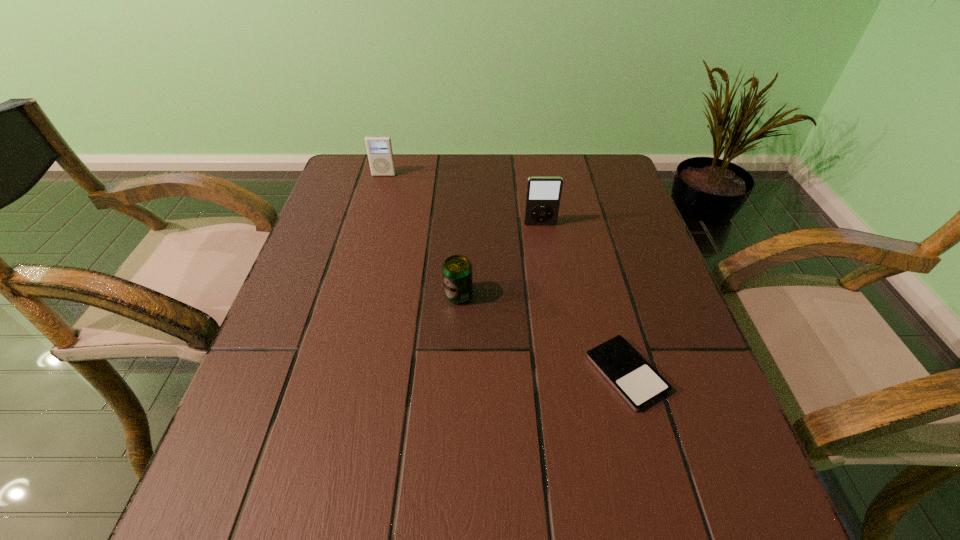
Locate an element on the screen. This screenshot has width=960, height=540. vacant region between the third object from left to right and the shortest object is located at coordinates (584, 299).

The width and height of the screenshot is (960, 540). Find the location of `unoccupied area between the third farthest object and the second farthest object`. unoccupied area between the third farthest object and the second farthest object is located at coordinates point(499,260).

Point out which object is positioned as the second nearest to the second iPod from left to right. Please provide its 2D coordinates. Your answer should be formatted as a tuple, i.e. [(x, y)], where the tuple contains the x and y coordinates of a point satisfying the conditions above.

[(639, 384)]

Locate which object is the closest to the second nearest iPod. Please provide its 2D coordinates. Your answer should be formatted as a tuple, i.e. [(x, y)], where the tuple contains the x and y coordinates of a point satisfying the conditions above.

[(457, 269)]

Identify the location of the closest iPod to the farthest iPod. (543, 194).

Point out which iPod is positioned as the nearest to the shortest iPod. Please provide its 2D coordinates. Your answer should be formatted as a tuple, i.e. [(x, y)], where the tuple contains the x and y coordinates of a point satisfying the conditions above.

[(543, 194)]

Identify the location of vacant area that satisfies the following two spatial constraints: 1. on the front-facing side of the rightmost iPod; 2. on the left side of the leftmost object. This screenshot has width=960, height=540. (328, 373).

You are a GUI agent. You are given a task and a screenshot of the screen. Output one action in this format:
    pyautogui.click(x=<x>, y=<y>)
    Task: Click on the vacant space that satisfies the following two spatial constraints: 1. on the front-facing side of the beer can; 2. on the left side of the leftmost iPod
    The height and width of the screenshot is (540, 960).
    Given the screenshot: What is the action you would take?
    pyautogui.click(x=350, y=295)

Where is `vacant space that satisfies the following two spatial constraints: 1. on the front-facing side of the rightmost object; 2. on the left side of the farthest object`? The image size is (960, 540). vacant space that satisfies the following two spatial constraints: 1. on the front-facing side of the rightmost object; 2. on the left side of the farthest object is located at coordinates (328, 373).

At what (x,y) coordinates should I click in order to perform the action: click on free space that satisfies the following two spatial constraints: 1. on the front-facing side of the leftmost iPod; 2. on the right side of the nearest object. Please return your answer as a coordinate pair (x, y). Image resolution: width=960 pixels, height=540 pixels. Looking at the image, I should click on (328, 373).